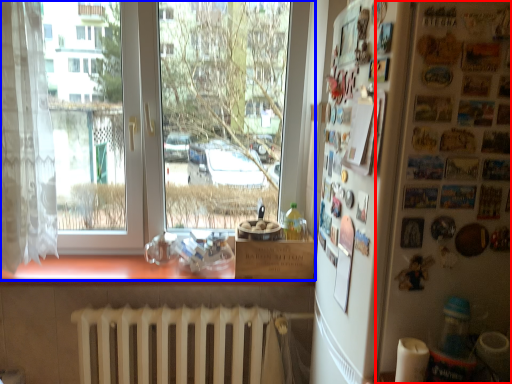
Question: Which of the following is the farthest to the observer, bulletin board (highlighted by a red box) or window (highlighted by a blue box)?

Choices:
 (A) bulletin board
 (B) window

Answer: (B)